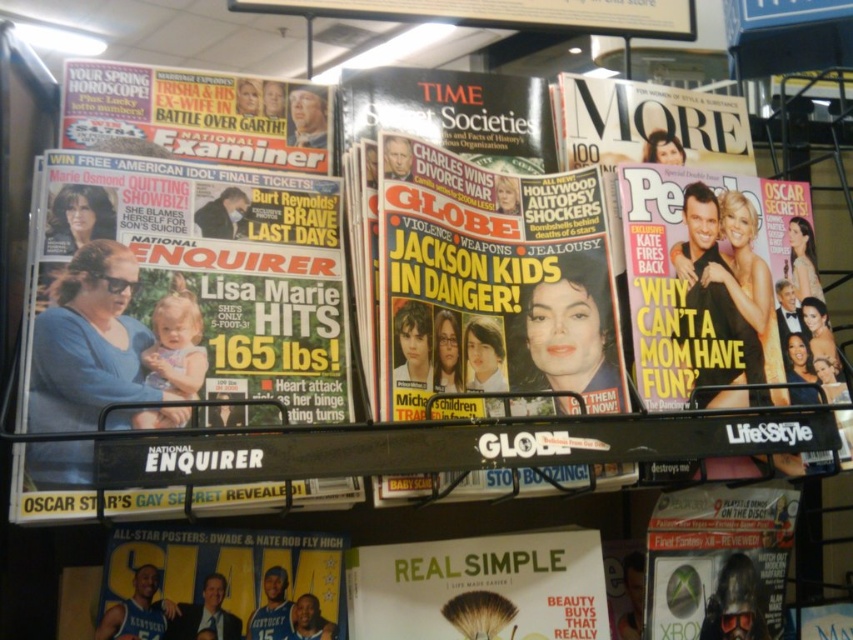
You are standing in front of the magazine rack and notice the blue fabric poster at lower center. Based on its position, can you determine if it is closer to the top or bottom edge of the rack?

The blue fabric poster at lower center is located at point coordinates that are closer to the bottom edge of the rack, so it is positioned near the bottom.

You are a customer browsing the magazine rack and see the blue fabric poster at lower center and the matte white magazine at center. Which one is taller?

The blue fabric poster at lower center is taller than the matte white magazine at center.

You are a store employee organizing the magazine rack. You need to place a new promotional poster that is 6 inches wide between the blue fabric poster at lower center and the matte white magazine at center. Is there enough space between them to fit the poster without overlapping?

The blue fabric poster at lower center and matte white magazine at center are 5.61 inches apart from each other. Since the new promotional poster is 6 inches wide, there isn not enough space between them to fit the poster without overlapping.